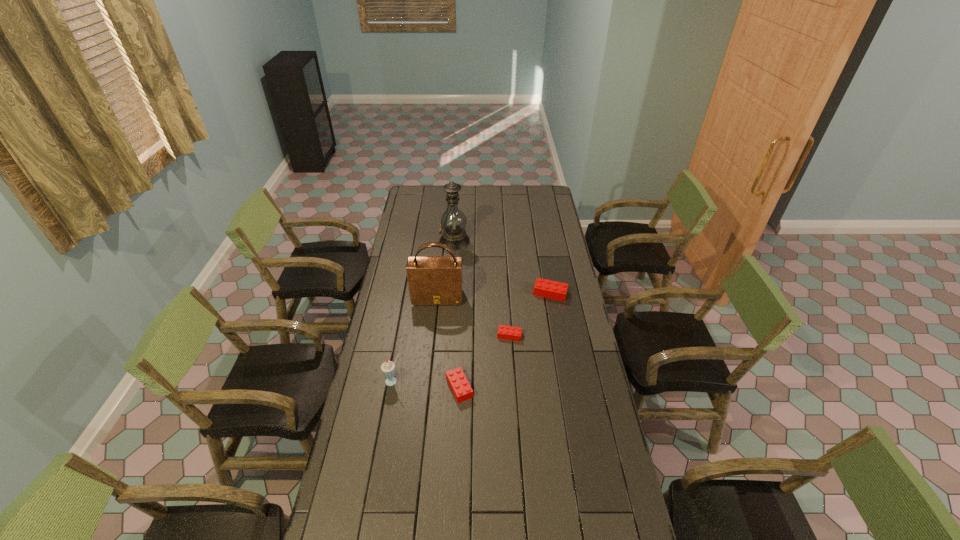
At what (x,y) coordinates should I click in order to perform the action: click on the second shortest object. Please return your answer as a coordinate pair (x, y). Looking at the image, I should click on (458, 382).

You are a GUI agent. You are given a task and a screenshot of the screen. Output one action in this format:
    pyautogui.click(x=<x>, y=<y>)
    Task: Click on the nearest Lego
    
    Given the screenshot: What is the action you would take?
    [458, 382]

What are the coordinates of `the second object from right to left` in the screenshot? It's located at (504, 332).

I want to click on the shortest object, so click(x=504, y=332).

Where is `the rightmost Lego`? the rightmost Lego is located at coordinates (555, 290).

You are a GUI agent. You are given a task and a screenshot of the screen. Output one action in this format:
    pyautogui.click(x=<x>, y=<y>)
    Task: Click on the rightmost object
    
    Given the screenshot: What is the action you would take?
    pyautogui.click(x=555, y=290)

Image resolution: width=960 pixels, height=540 pixels. Find the location of `shoulder bag`. shoulder bag is located at coordinates (432, 280).

Locate an element on the screen. This screenshot has height=540, width=960. oil lamp is located at coordinates (453, 221).

This screenshot has width=960, height=540. What are the coordinates of `milkshake` in the screenshot? It's located at (388, 368).

The height and width of the screenshot is (540, 960). In order to click on free location located on the back of the fifth tallest object in this screenshot , I will do `click(463, 302)`.